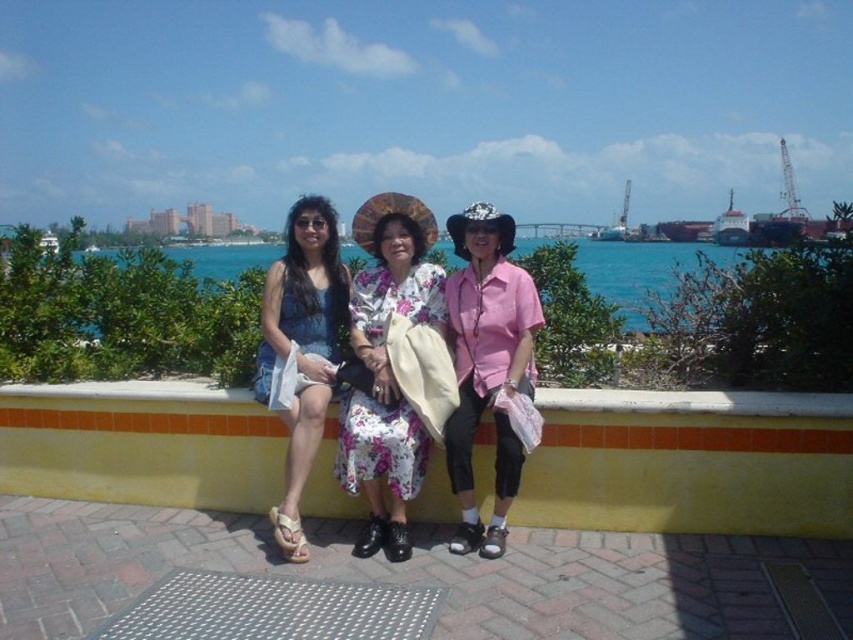
Question: Does yellow tile ledge at center have a lesser width compared to floral fabric dress at center?

Choices:
 (A) yes
 (B) no

Answer: (B)

Question: Which point is farther from the camera taking this photo?

Choices:
 (A) (495, 314)
 (B) (326, 342)
 (C) (579, 428)
 (D) (346, 483)

Answer: (B)

Question: Which point is closer to the camera taking this photo?

Choices:
 (A) (323, 378)
 (B) (515, 451)

Answer: (B)

Question: Is denim dress at center thinner than blue water at center?

Choices:
 (A) no
 (B) yes

Answer: (B)

Question: Which point appears closest to the camera in this image?

Choices:
 (A) (846, 509)
 (B) (399, 497)

Answer: (A)

Question: Is yellow tile ledge at center wider than denim dress at center?

Choices:
 (A) yes
 (B) no

Answer: (A)